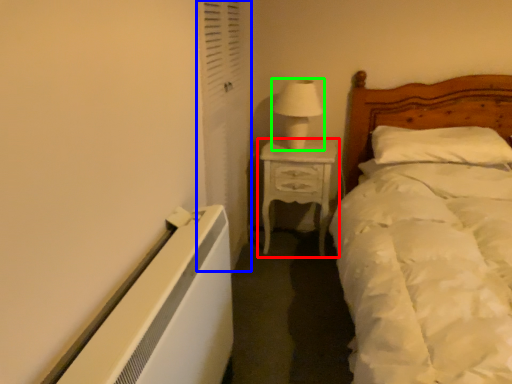
Question: Which is farther away from nightstand (highlighted by a red box)? screen door (highlighted by a blue box) or table lamp (highlighted by a green box)?

Choices:
 (A) screen door
 (B) table lamp

Answer: (A)